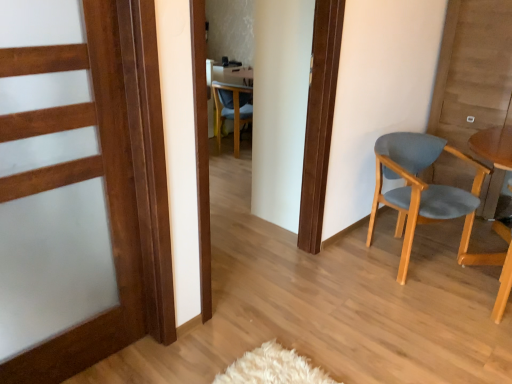
Locate an element on the screen. light blue fabric chair at right, placed as the second chair when sorted from left to right is located at coordinates coord(421,189).

From the picture: Measure the distance between point (244, 117) and camera.

Point (244, 117) is 4.44 meters away from camera.

The height and width of the screenshot is (384, 512). What are the coordinates of `light blue fabric chair at right, which ranks as the second chair in back-to-front order` in the screenshot? It's located at (421, 189).

The width and height of the screenshot is (512, 384). Identify the location of chair on the left side of light blue fabric chair at right, positioned as the first chair in front-to-back order. (231, 109).

Is light blue fabric chair at right, placed as the second chair when sorted from left to right, with blue fabric chair at center, which ranks as the first chair in left-to-right order?

There is a gap between light blue fabric chair at right, placed as the second chair when sorted from left to right, and blue fabric chair at center, which ranks as the first chair in left-to-right order.

From a real-world perspective, which is physically above, light blue fabric chair at right, positioned as the first chair in front-to-back order, or blue fabric chair at center, the 1th chair positioned from the back?

From a 3D spatial view, light blue fabric chair at right, positioned as the first chair in front-to-back order, is above.

Does light blue fabric chair at right, which ranks as the second chair in back-to-front order, have a larger size compared to blue fabric chair at center, which ranks as the first chair in left-to-right order?

Yes, light blue fabric chair at right, which ranks as the second chair in back-to-front order, is bigger than blue fabric chair at center, which ranks as the first chair in left-to-right order.

Is blue fabric chair at center, which is counted as the second chair, starting from the front, completely or partially outside of light blue fabric chair at right, placed as the second chair when sorted from left to right?

Yes, blue fabric chair at center, which is counted as the second chair, starting from the front, is not within light blue fabric chair at right, placed as the second chair when sorted from left to right.

Considering the points (237, 104) and (460, 254), which point is in front, point (237, 104) or point (460, 254)?

The point (460, 254) is in front.

Can you confirm if blue fabric chair at center, the second chair from the bottom, is bigger than light blue fabric chair at right, placed as the second chair when sorted from left to right?

Actually, blue fabric chair at center, the second chair from the bottom, might be smaller than light blue fabric chair at right, placed as the second chair when sorted from left to right.

At what (x,y) coordinates should I click in order to perform the action: click on chair below the light blue fabric chair at right, arranged as the first chair when viewed from the right (from a real-world perspective). Please return your answer as a coordinate pair (x, y). Looking at the image, I should click on (231, 109).

Is wooden door at left situated inside light blue fabric chair at right, placed as the second chair when sorted from left to right, or outside?

The correct answer is: outside.

Does wooden door at left have a lesser width compared to light blue fabric chair at right, positioned as the first chair in front-to-back order?

No.

Is wooden door at left at the right side of light blue fabric chair at right, the 1th chair positioned from the bottom?

No.

Is wooden door at left far away from light blue fabric chair at right, placed as the second chair when sorted from left to right?

Yes, wooden door at left and light blue fabric chair at right, placed as the second chair when sorted from left to right, are located far from each other.

From the image's perspective, is light blue fabric chair at right, placed as the second chair when sorted from left to right, beneath wooden door at left?

Incorrect, from the image's perspective, light blue fabric chair at right, placed as the second chair when sorted from left to right, is higher than wooden door at left.

Is light blue fabric chair at right, positioned as the first chair in front-to-back order, shorter than wooden door at left?

Correct, light blue fabric chair at right, positioned as the first chair in front-to-back order, is not as tall as wooden door at left.

From a real-world perspective, is light blue fabric chair at right, the 1th chair positioned from the bottom, on top of wooden door at left?

Actually, light blue fabric chair at right, the 1th chair positioned from the bottom, is physically below wooden door at left in the real world.

Where is `door above the light blue fabric chair at right, positioned as the first chair in front-to-back order (from a real-world perspective)`? Image resolution: width=512 pixels, height=384 pixels. door above the light blue fabric chair at right, positioned as the first chair in front-to-back order (from a real-world perspective) is located at coordinates 82,181.

Could you measure the distance between blue fabric chair at center, which is counted as the second chair, starting from the front, and wooden door at left?

blue fabric chair at center, which is counted as the second chair, starting from the front, and wooden door at left are 9.51 feet apart from each other.

Is blue fabric chair at center, placed as the second chair when sorted from right to left, facing away from wooden door at left?

That's not correct — blue fabric chair at center, placed as the second chair when sorted from right to left, is not looking away from wooden door at left.

Considering the positions of point (241, 108) and point (42, 125), is point (241, 108) closer or farther from the camera than point (42, 125)?

Point (241, 108) appears to be farther away from the viewer than point (42, 125).

Would you say wooden door at left is part of blue fabric chair at center, which is counted as the second chair, starting from the front,'s contents?

No, wooden door at left is not inside blue fabric chair at center, which is counted as the second chair, starting from the front.

Considering the sizes of objects wooden door at left and blue fabric chair at center, the 1th chair positioned from the back, in the image provided, who is thinner, wooden door at left or blue fabric chair at center, the 1th chair positioned from the back,?

blue fabric chair at center, the 1th chair positioned from the back, is thinner.

Is wooden door at left aimed at blue fabric chair at center, the second chair from the bottom?

No, wooden door at left is not facing towards blue fabric chair at center, the second chair from the bottom.

Which is in front, wooden door at left or blue fabric chair at center, which ranks as the first chair in left-to-right order?

wooden door at left is in front.

This screenshot has height=384, width=512. In order to click on chair below the blue fabric chair at center, which ranks as the first chair in left-to-right order (from the image's perspective) in this screenshot , I will do `click(421, 189)`.

The image size is (512, 384). Find the location of `chair that appears on the left of light blue fabric chair at right, positioned as the first chair in front-to-back order`. chair that appears on the left of light blue fabric chair at right, positioned as the first chair in front-to-back order is located at coordinates (231, 109).

Which object lies nearer to the anchor point blue fabric chair at center, which is counted as the second chair, starting from the front, wooden door at left or light blue fabric chair at right, the 1th chair positioned from the bottom?

light blue fabric chair at right, the 1th chair positioned from the bottom.

Considering their positions, is blue fabric chair at center, the second chair from the bottom, positioned further to light blue fabric chair at right, which ranks as the second chair in back-to-front order, than wooden door at left?

Among the two, blue fabric chair at center, the second chair from the bottom, is located further to light blue fabric chair at right, which ranks as the second chair in back-to-front order.

From the image, which object appears to be nearer to wooden door at left, light blue fabric chair at right, placed as the second chair when sorted from left to right, or blue fabric chair at center, the 1th chair in the top-to-bottom sequence?

light blue fabric chair at right, placed as the second chair when sorted from left to right, lies closer to wooden door at left than the other object.

Based on their spatial positions, is wooden door at left or blue fabric chair at center, which is counted as the second chair, starting from the front, further from light blue fabric chair at right, arranged as the first chair when viewed from the right?

blue fabric chair at center, which is counted as the second chair, starting from the front.

When comparing their distances from wooden door at left, does blue fabric chair at center, which is counted as the second chair, starting from the front, or light blue fabric chair at right, placed as the second chair when sorted from left to right, seem further?

blue fabric chair at center, which is counted as the second chair, starting from the front, is positioned further to the anchor wooden door at left.

When comparing their distances from blue fabric chair at center, placed as the second chair when sorted from right to left, does light blue fabric chair at right, positioned as the first chair in front-to-back order, or wooden door at left seem closer?

The object closer to blue fabric chair at center, placed as the second chair when sorted from right to left, is light blue fabric chair at right, positioned as the first chair in front-to-back order.

Locate an element on the screen. The width and height of the screenshot is (512, 384). chair between wooden door at left and blue fabric chair at center, which ranks as the first chair in left-to-right order, along the z-axis is located at coordinates (421, 189).